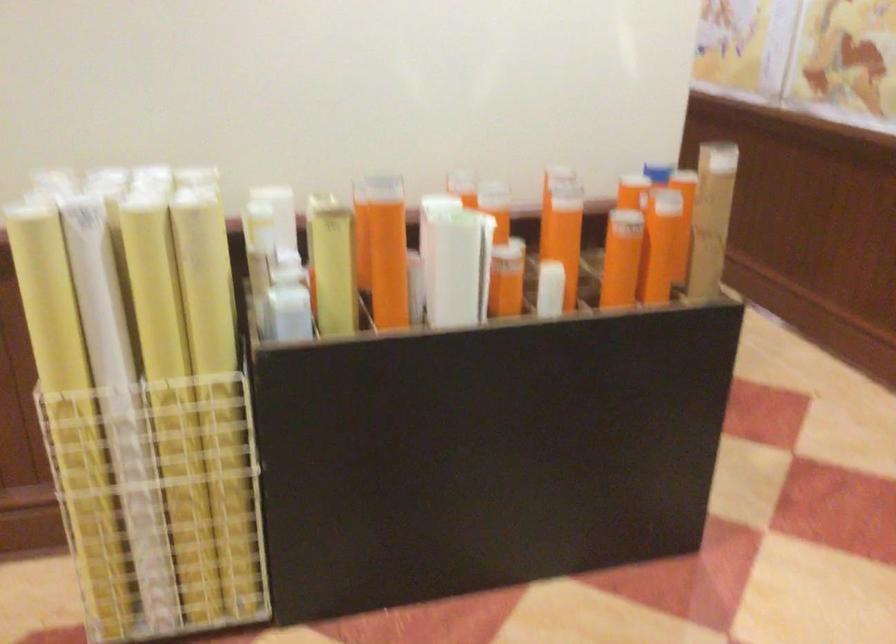
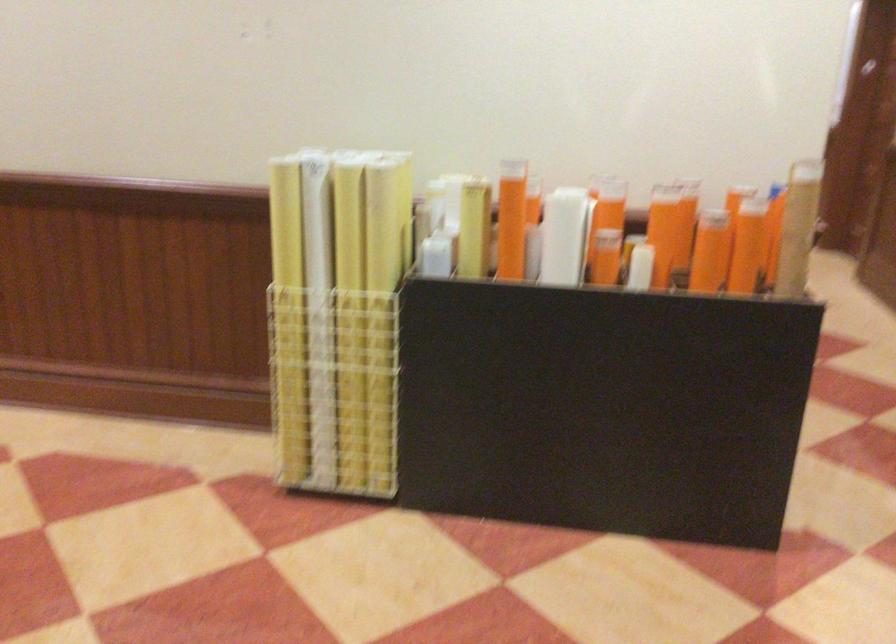
Where in the second image is the point corresponding to the point at 503,259 from the first image?

(606, 241)